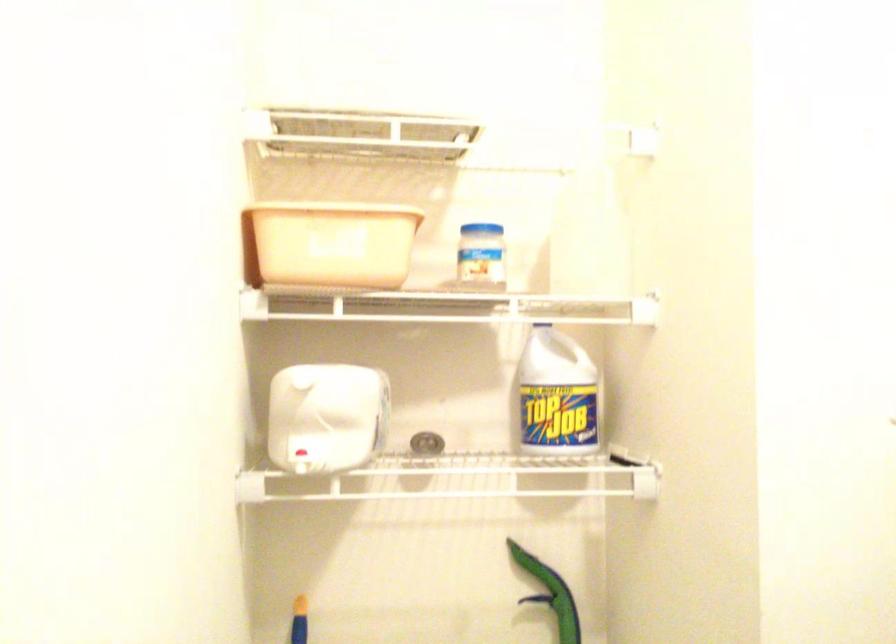
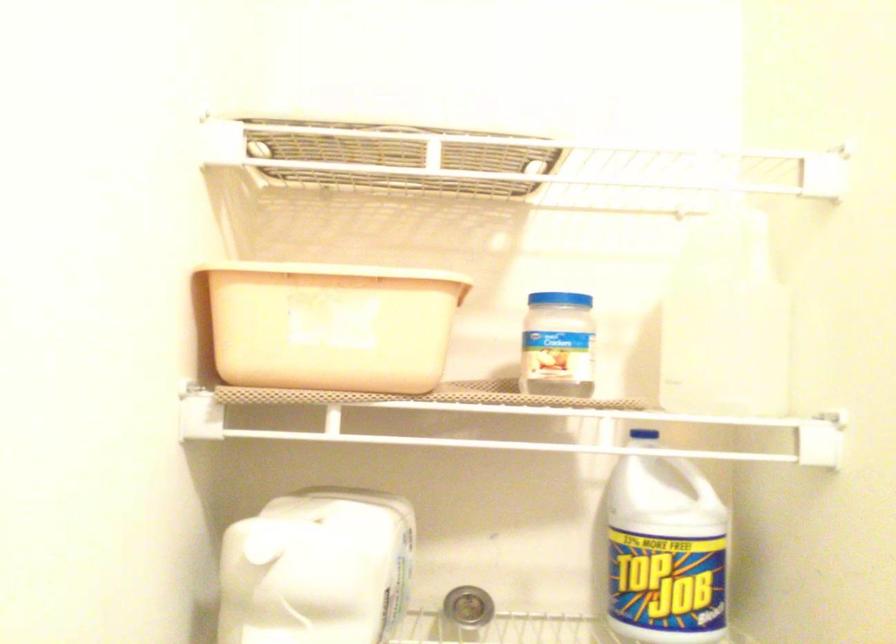
Find the pixel in the second image that matches point 588,348 in the first image.

(704, 471)